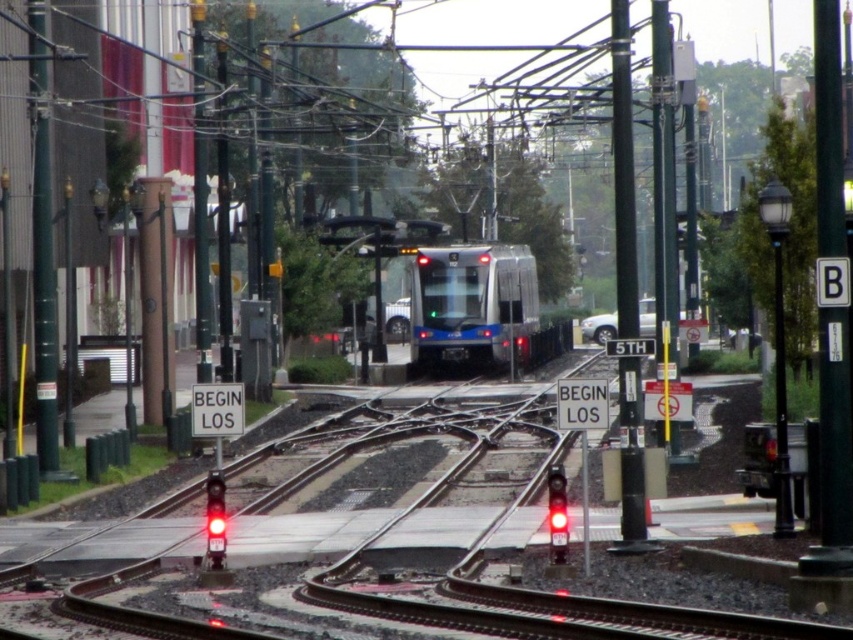
You are a delivery robot with a 2.5 meter wide package. You need to move along the tracks between the black metal pole at center right and the metallic pole at right. Can you fit through the space between them?

The distance between the black metal pole at center right and the metallic pole at right is 4.64 meters, which is wider than the 2.5 meter width of your package. Therefore, you can safely move through the space between them.

You are a city planner analyzing the urban layout. Given the coordinates of the metallic silver train at center, what is its exact position in the image?

The metallic silver train at center is exactly located at coordinates point (473, 305).